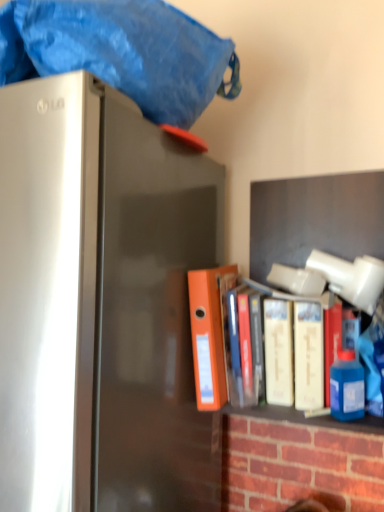
Question: Would you say orange matte folder at center, which is counted as the first book, starting from the left, is inside or outside satin silver refrigerator at left?

Choices:
 (A) inside
 (B) outside

Answer: (B)

Question: Is point (210, 280) closer or farther from the camera than point (102, 265)?

Choices:
 (A) closer
 (B) farther

Answer: (B)

Question: Estimate the real-world distances between objects in this image. Which object is closer to the blue fabric at top?

Choices:
 (A) blue plastic bottle at right
 (B) white matte book at center, which is counted as the second book, starting from the left
 (C) satin silver refrigerator at left
 (D) orange matte folder at center, which is counted as the first book, starting from the left

Answer: (C)

Question: Which is nearer to the blue fabric at top?

Choices:
 (A) blue plastic bottle at right
 (B) satin silver refrigerator at left
 (C) orange matte folder at center, which is counted as the first book, starting from the left
 (D) white matte book at center, the 1th book viewed from the right

Answer: (B)